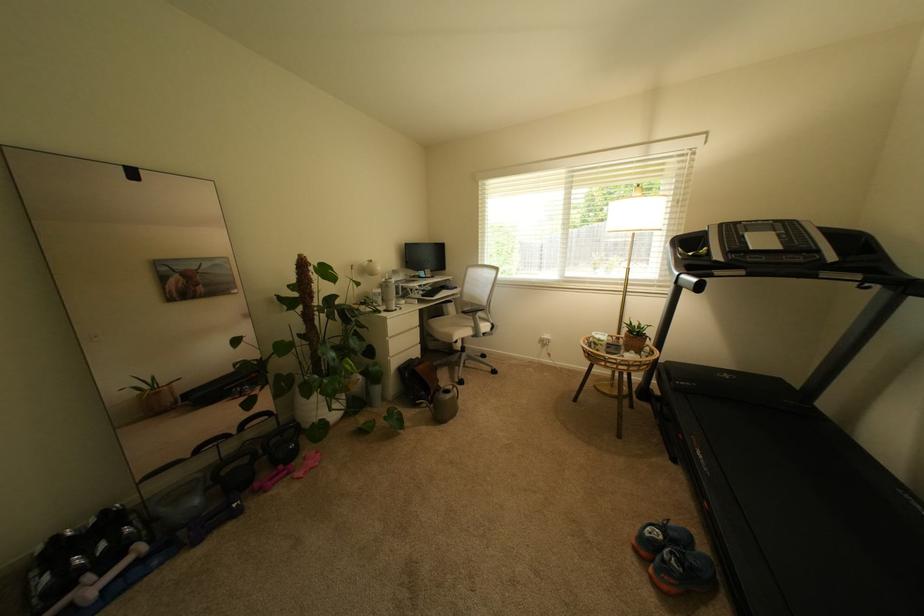
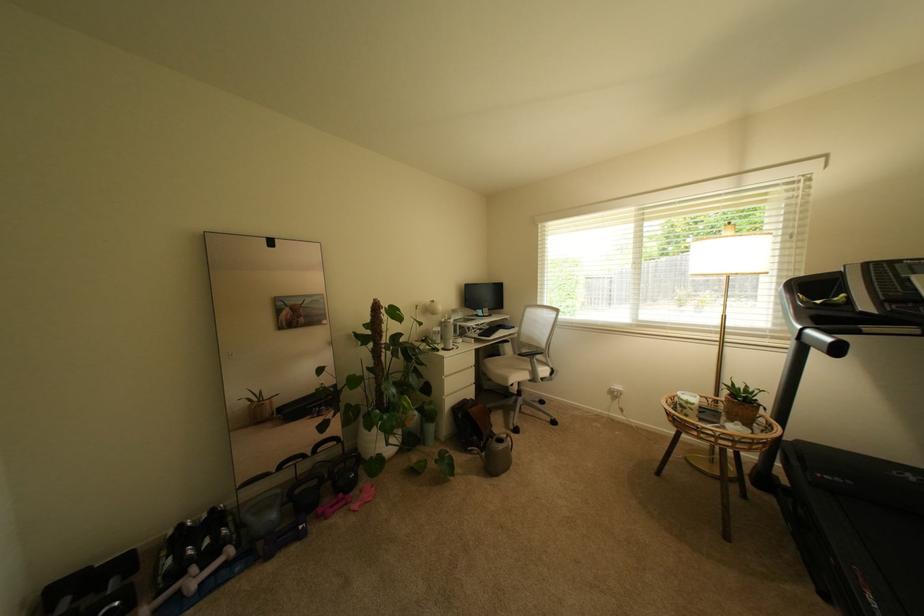
Locate, in the second image, the point that corresponds to (x=481, y=326) in the first image.

(540, 370)